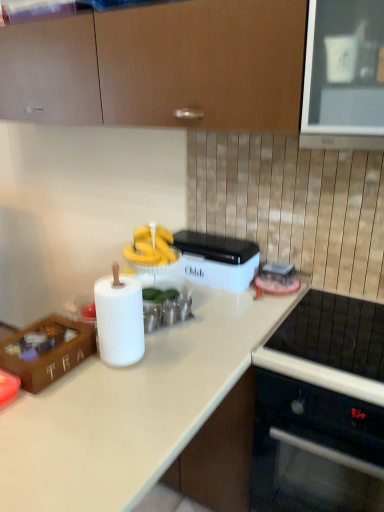
I want to click on free space on the front side of wooden tea box at lower left, so click(54, 406).